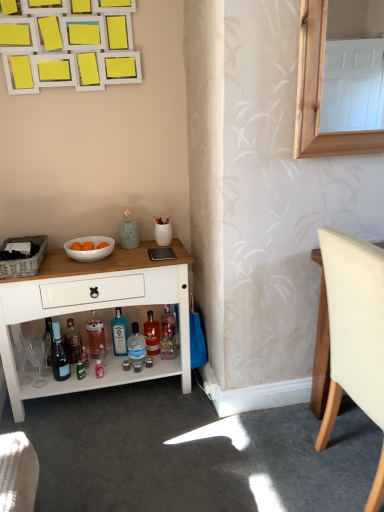
Question: Does translucent plastic bottle at lower center, positioned as the fourth bottle in right-to-left order, have a larger size compared to clear plastic bottle at lower center, which appears as the 2th bottle when viewed from the right?

Choices:
 (A) yes
 (B) no

Answer: (B)

Question: Is translucent plastic bottle at lower center, which is the 2th bottle in left-to-right order, smaller than clear plastic bottle at lower center, the 4th bottle in the left-to-right sequence?

Choices:
 (A) yes
 (B) no

Answer: (A)

Question: Does translucent plastic bottle at lower center, positioned as the fourth bottle in right-to-left order, have a greater width compared to clear plastic bottle at lower center, the 4th bottle in the left-to-right sequence?

Choices:
 (A) no
 (B) yes

Answer: (A)

Question: Does translucent plastic bottle at lower center, which is the 2th bottle in left-to-right order, have a lesser height compared to clear plastic bottle at lower center, which appears as the 2th bottle when viewed from the right?

Choices:
 (A) yes
 (B) no

Answer: (B)

Question: Is clear plastic bottle at lower center, the 4th bottle in the left-to-right sequence, surrounded by translucent plastic bottle at lower center, which is the 2th bottle in left-to-right order?

Choices:
 (A) yes
 (B) no

Answer: (B)

Question: Based on their positions, is translucent plastic bottle at lower center, which is the 2th bottle in left-to-right order, located to the left or right of shiny dark glass bottle at lower left, placed as the 1th bottle when sorted from left to right?

Choices:
 (A) left
 (B) right

Answer: (B)

Question: In terms of width, does translucent plastic bottle at lower center, positioned as the fourth bottle in right-to-left order, look wider or thinner when compared to shiny dark glass bottle at lower left, arranged as the 5th bottle when viewed from the right?

Choices:
 (A) wide
 (B) thin

Answer: (B)

Question: From the image's perspective, relative to shiny dark glass bottle at lower left, arranged as the 5th bottle when viewed from the right, is translucent plastic bottle at lower center, which is the 2th bottle in left-to-right order, above or below?

Choices:
 (A) below
 (B) above

Answer: (B)

Question: Do you think translucent plastic bottle at lower center, which is the 2th bottle in left-to-right order, is within shiny dark glass bottle at lower left, arranged as the 5th bottle when viewed from the right, or outside of it?

Choices:
 (A) inside
 (B) outside

Answer: (B)

Question: Is translucent glass bottle at lower center, the first bottle in the right-to-left sequence, inside the boundaries of matte black picnic basket at left, or outside?

Choices:
 (A) outside
 (B) inside

Answer: (A)

Question: Based on their sizes in the image, would you say translucent glass bottle at lower center, which is the fifth bottle from left to right, is bigger or smaller than matte black picnic basket at left?

Choices:
 (A) small
 (B) big

Answer: (A)

Question: In the image, is translucent glass bottle at lower center, the first bottle in the right-to-left sequence, on the left side or the right side of matte black picnic basket at left?

Choices:
 (A) right
 (B) left

Answer: (A)

Question: From the image's perspective, is translucent glass bottle at lower center, which is the fifth bottle from left to right, above or below matte black picnic basket at left?

Choices:
 (A) above
 (B) below

Answer: (B)

Question: Is point (11, 266) closer or farther from the camera than point (147, 316)?

Choices:
 (A) farther
 (B) closer

Answer: (B)

Question: From a real-world perspective, relative to translucent glass bottle at lower center, the first bottle in the right-to-left sequence, is matte black picnic basket at left vertically above or below?

Choices:
 (A) above
 (B) below

Answer: (A)